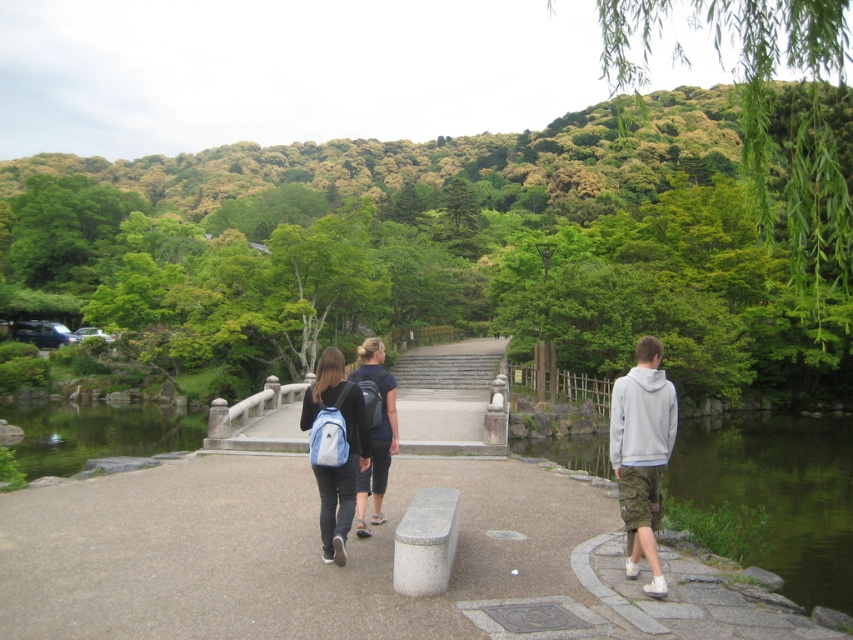
You are standing at the starting point of the smooth concrete path at center. What are the coordinates of the path?

The coordinates of the smooth concrete path at center are at point (329, 564).

From the picture: You are planning to walk along the smooth concrete path at center and the green stone river at lower right. Which one has a higher elevation?

The green stone river at lower right has a higher elevation than the smooth concrete path at center.

You are standing at the camera position and want to reach the green smooth water at lower left. Is the distance less than 50 feet?

The green smooth water at lower left is 45.60 feet away from camera, so yes, the distance is less than 50 feet.